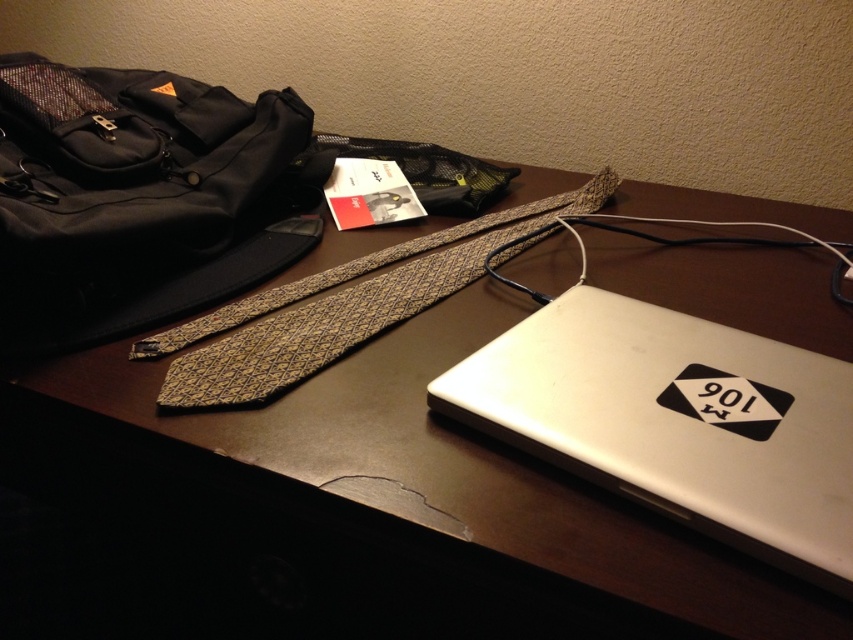
Is satin silver laptop at lower right bigger than gold textured tie at center?

Actually, satin silver laptop at lower right might be smaller than gold textured tie at center.

Measure the distance from satin silver laptop at lower right to gold textured tie at center.

A distance of 7.96 inches exists between satin silver laptop at lower right and gold textured tie at center.

Measure the distance between point (556, 310) and camera.

The distance of point (556, 310) from camera is 22.53 inches.

You are a GUI agent. You are given a task and a screenshot of the screen. Output one action in this format:
    pyautogui.click(x=<x>, y=<y>)
    Task: Click on the satin silver laptop at lower right
    The image size is (853, 640).
    Given the screenshot: What is the action you would take?
    676,420